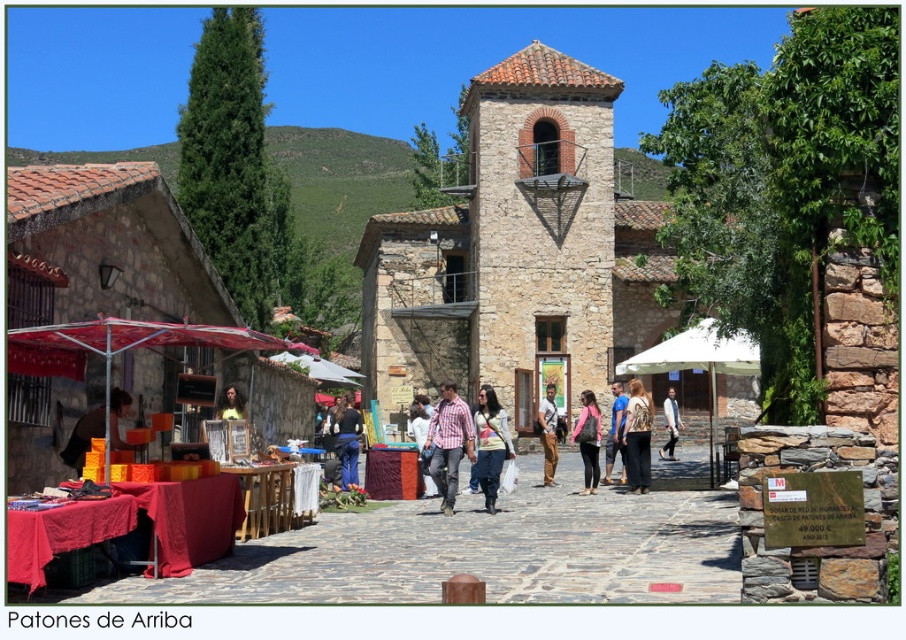
Question: Which point is closer to the camera?

Choices:
 (A) plaid cotton shirt at center
 (B) denim pants at center
 (C) denim jacket at center
 (D) brown stone tower at center

Answer: (C)

Question: Observing the image, what is the correct spatial positioning of matte orange crate at center in reference to denim pants at center?

Choices:
 (A) above
 (B) below

Answer: (A)

Question: Is the position of denim pants at center less distant than that of light brown leather jacket at center?

Choices:
 (A) yes
 (B) no

Answer: (A)

Question: Which object is positioned closest to the brown stone tower at center?

Choices:
 (A) light brown leather jacket at center
 (B) brown leather pants at center

Answer: (B)

Question: Which of the following is the closest to the observer?

Choices:
 (A) brown leather pants at center
 (B) white fabric umbrella at center

Answer: (B)

Question: Does matte orange crate at center come in front of blue denim jeans at center?

Choices:
 (A) yes
 (B) no

Answer: (A)